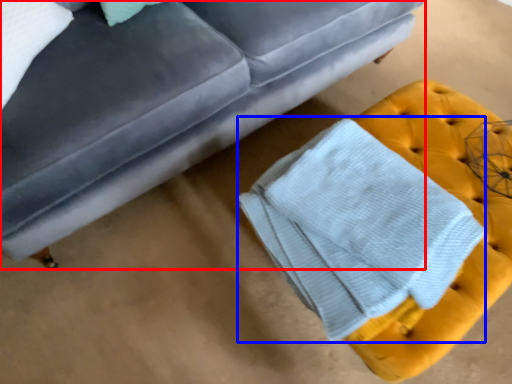
Question: Among these objects, which one is farthest to the camera, studio couch (highlighted by a red box) or bath towel (highlighted by a blue box)?

Choices:
 (A) studio couch
 (B) bath towel

Answer: (B)